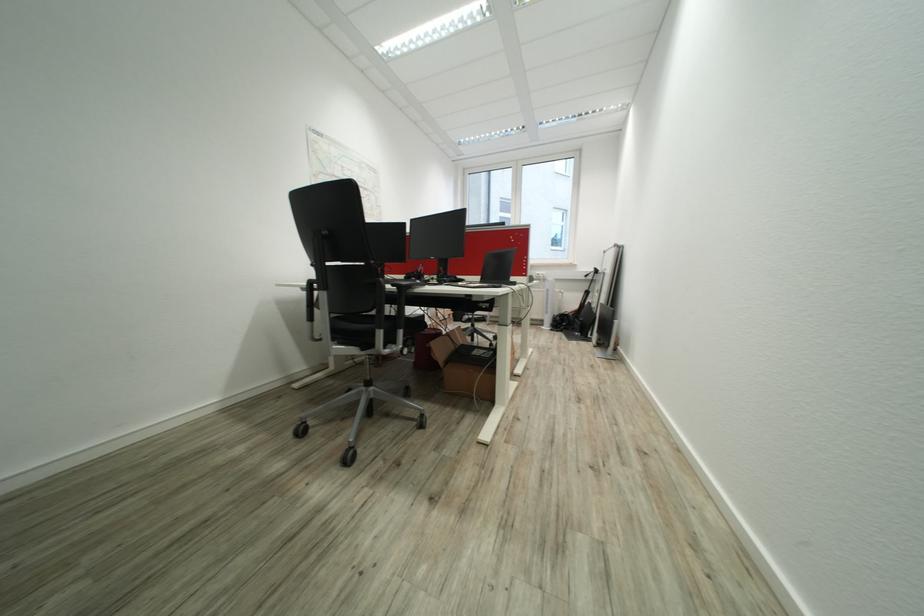
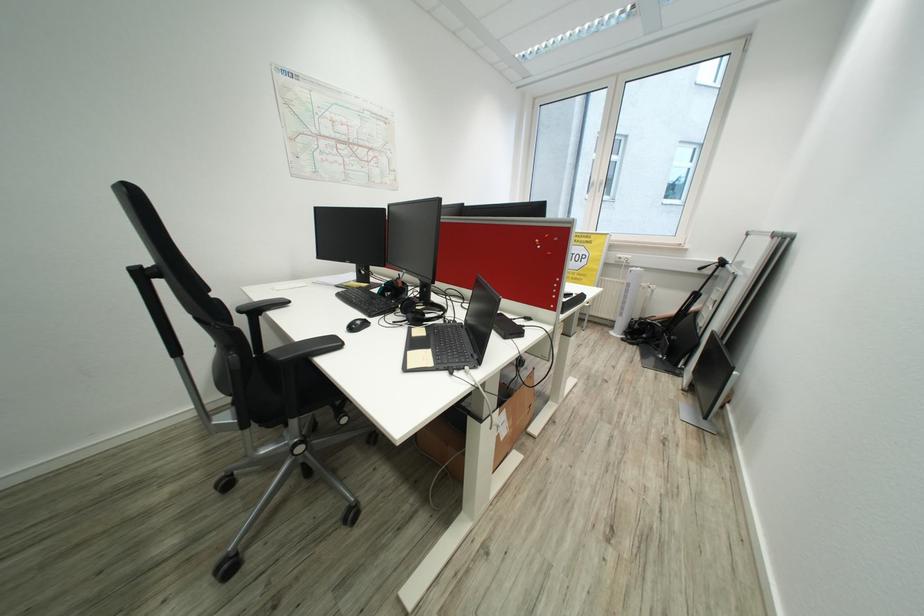
Question: How did the camera likely rotate?

Choices:
 (A) Left
 (B) Right
 (C) Up
 (D) Down

Answer: (A)